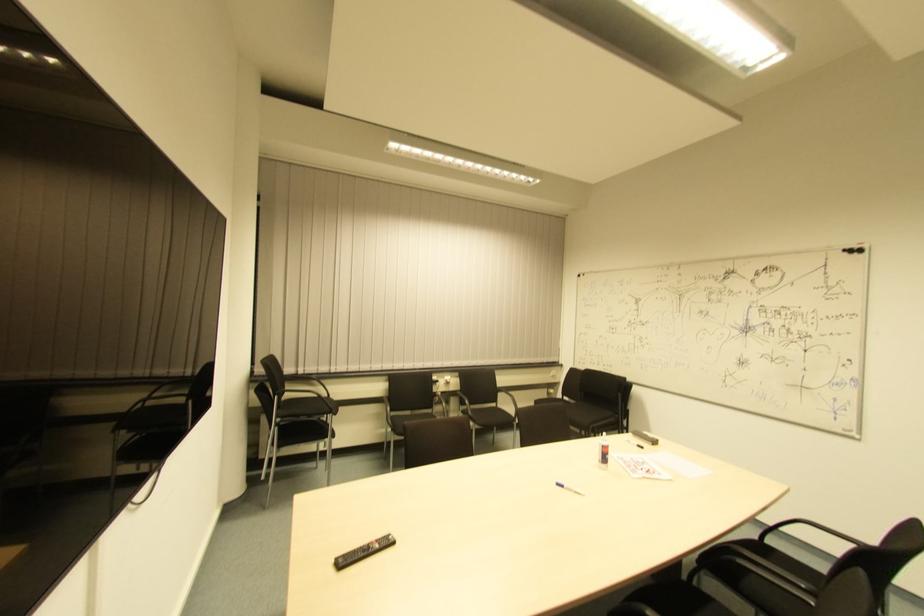
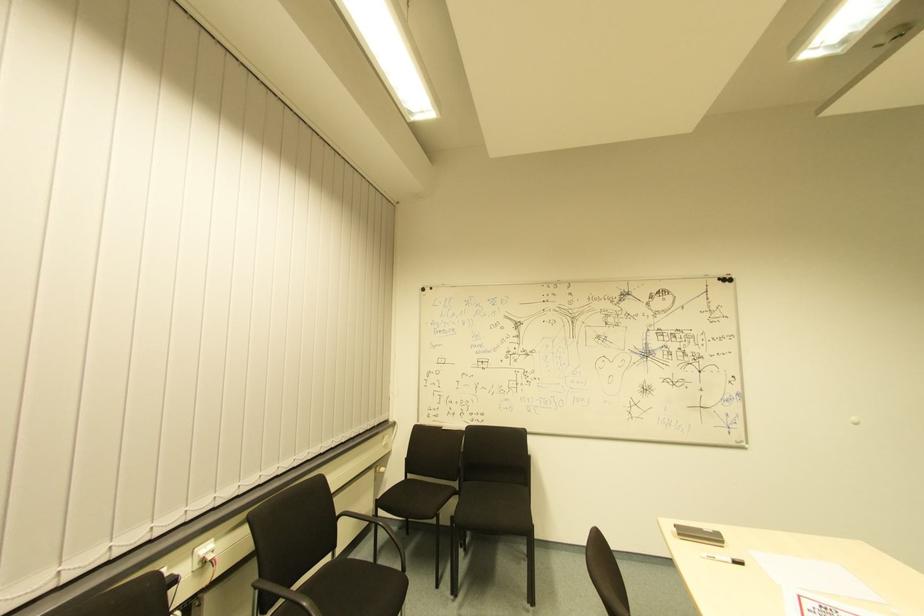
Where in the second image is the point corresponding to [639,450] from the first image?

(737, 565)